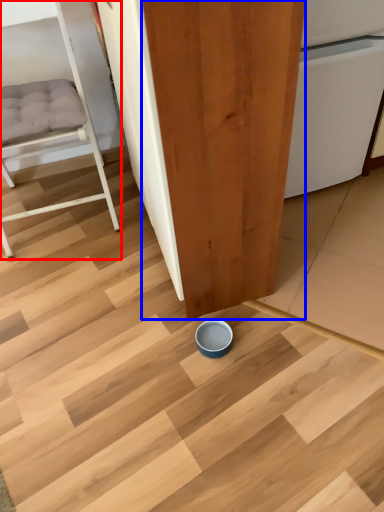
Question: Which object is closer to the camera taking this photo, furniture (highlighted by a red box) or plywood (highlighted by a blue box)?

Choices:
 (A) furniture
 (B) plywood

Answer: (B)